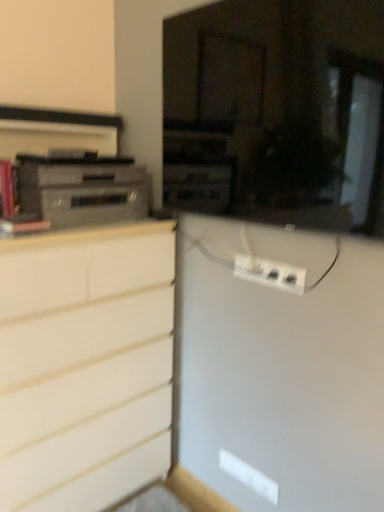
Question: Considering the relative positions of satin silver stereo at left and white plastic power strip at center in the image provided, is satin silver stereo at left to the left of white plastic power strip at center from the viewer's perspective?

Choices:
 (A) yes
 (B) no

Answer: (A)

Question: From the image's perspective, is satin silver stereo at left on white plastic power strip at center?

Choices:
 (A) no
 (B) yes

Answer: (B)

Question: Is the position of satin silver stereo at left more distant than that of white plastic power strip at center?

Choices:
 (A) no
 (B) yes

Answer: (B)

Question: Is satin silver stereo at left positioned in front of white plastic power strip at center?

Choices:
 (A) no
 (B) yes

Answer: (A)

Question: Does satin silver stereo at left contain white plastic power strip at center?

Choices:
 (A) no
 (B) yes

Answer: (A)

Question: From a real-world perspective, is white plastic power strip at center above or below satin silver stereo at left?

Choices:
 (A) above
 (B) below

Answer: (B)

Question: In terms of width, does white plastic power strip at center look wider or thinner when compared to satin silver stereo at left?

Choices:
 (A) thin
 (B) wide

Answer: (A)

Question: Which is correct: white plastic power strip at center is inside satin silver stereo at left, or outside of it?

Choices:
 (A) inside
 (B) outside

Answer: (B)

Question: Is point (240, 258) positioned closer to the camera than point (104, 194)?

Choices:
 (A) farther
 (B) closer

Answer: (B)

Question: Is satin silver stereo at left inside the boundaries of white plastic power strip at center, or outside?

Choices:
 (A) outside
 (B) inside

Answer: (A)

Question: From the image's perspective, is satin silver stereo at left positioned above or below white plastic power strip at center?

Choices:
 (A) below
 (B) above

Answer: (B)

Question: Visually, is satin silver stereo at left positioned to the left or to the right of white plastic power strip at center?

Choices:
 (A) left
 (B) right

Answer: (A)

Question: Is point click(x=43, y=180) positioned closer to the camera than point click(x=240, y=272)?

Choices:
 (A) farther
 (B) closer

Answer: (B)

Question: From the image's perspective, is white matte chest of drawers at left located above or below white plastic power strip at center?

Choices:
 (A) above
 (B) below

Answer: (B)

Question: Considering the positions of white matte chest of drawers at left and white plastic power strip at center in the image, is white matte chest of drawers at left bigger or smaller than white plastic power strip at center?

Choices:
 (A) small
 (B) big

Answer: (B)